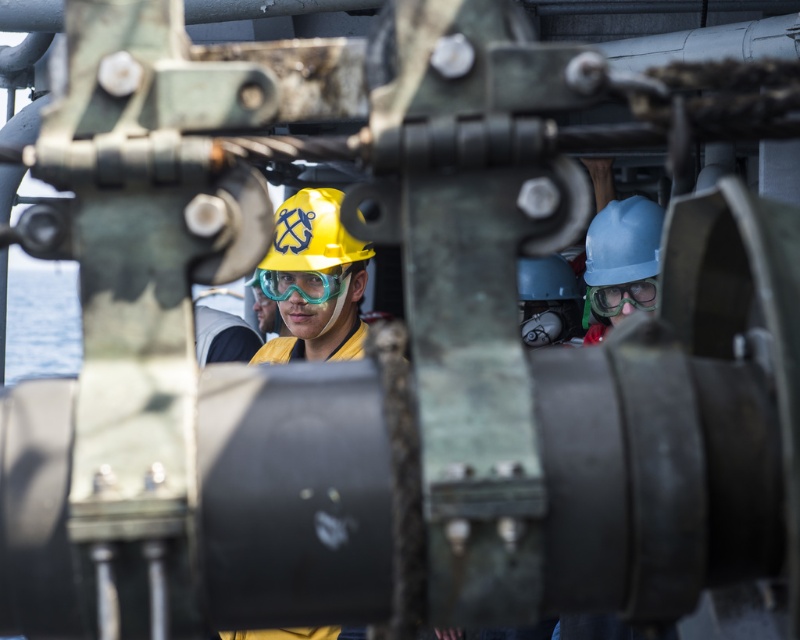
Does blue matte hard hat at center appear under transparent plastic goggles at center?

Actually, blue matte hard hat at center is above transparent plastic goggles at center.

Between point (604, 230) and point (625, 289), which one is positioned in front?

Point (625, 289)

Which is in front, point (645, 228) or point (616, 285)?

Point (616, 285) is more forward.

Find the location of a particular element. This screenshot has height=640, width=800. blue matte hard hat at center is located at coordinates (624, 241).

Which is more to the right, blue matte helmet at center or transparent plastic goggles at center?

From the viewer's perspective, transparent plastic goggles at center appears more on the right side.

Between point (537, 307) and point (604, 285), which one is positioned in front?

Point (604, 285)

You are a GUI agent. You are given a task and a screenshot of the screen. Output one action in this format:
    pyautogui.click(x=<x>, y=<y>)
    Task: Click on the blue matte helmet at center
    This screenshot has height=640, width=800.
    Given the screenshot: What is the action you would take?
    pyautogui.click(x=548, y=300)

Between blue matte hard hat at center and translucent plastic goggles at center, which one is positioned higher?

blue matte hard hat at center

Does blue matte hard hat at center have a greater height compared to translucent plastic goggles at center?

Indeed, blue matte hard hat at center has a greater height compared to translucent plastic goggles at center.

I want to click on blue matte hard hat at center, so click(624, 241).